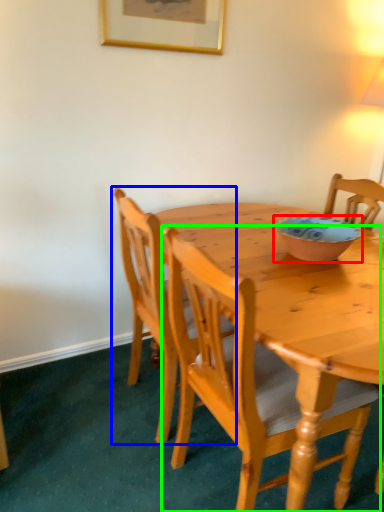
Question: Estimate the real-world distances between objects in this image. Which object is farther from bowl (highlighted by a red box), chair (highlighted by a blue box) or chair (highlighted by a green box)?

Choices:
 (A) chair
 (B) chair

Answer: (A)